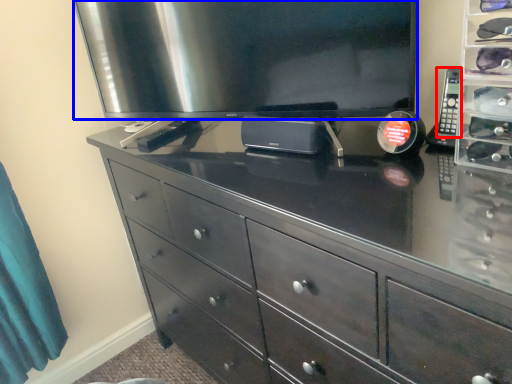
Question: Which object appears farthest to the camera in this image, control (highlighted by a red box) or television (highlighted by a blue box)?

Choices:
 (A) control
 (B) television

Answer: (A)